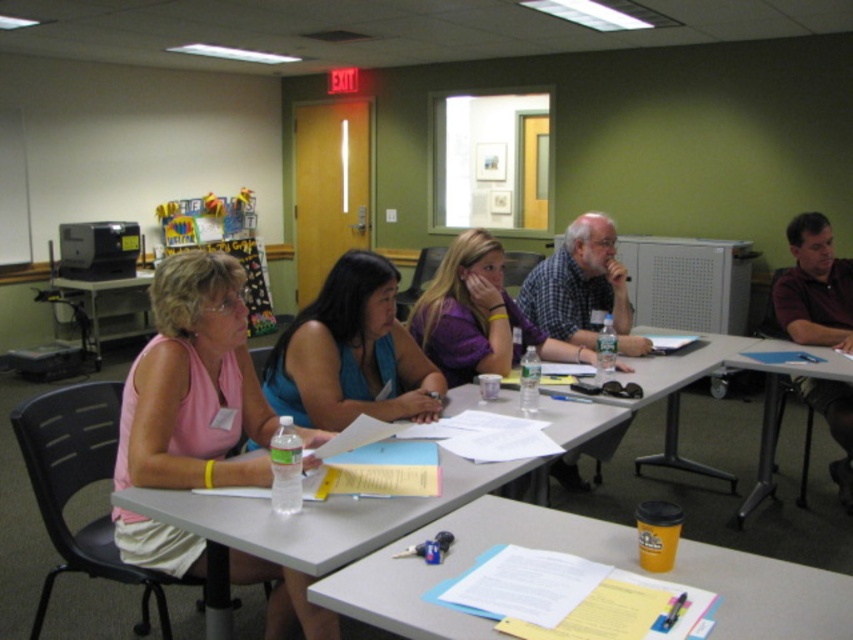
Question: Is metallic gray table at lower right to the left of white matte bulletin board at upper left from the viewer's perspective?

Choices:
 (A) no
 (B) yes

Answer: (A)

Question: Which of these objects is positioned closest to the purple fabric shirt at center?

Choices:
 (A) matte plastic table at center
 (B) white matte bulletin board at upper left

Answer: (A)

Question: Among these objects, which one is farthest from the camera?

Choices:
 (A) purple fabric shirt at center
 (B) pink fabric shirt at left

Answer: (A)

Question: Is gray plastic table at center positioned before purple fabric shirt at center?

Choices:
 (A) yes
 (B) no

Answer: (A)

Question: Among these objects, which one is nearest to the camera?

Choices:
 (A) matte plastic table at center
 (B) purple fabric shirt at center
 (C) white matte bulletin board at upper left

Answer: (B)

Question: From the image, what is the correct spatial relationship of gray plastic table at center in relation to dark brown shirt at right?

Choices:
 (A) right
 (B) left

Answer: (B)